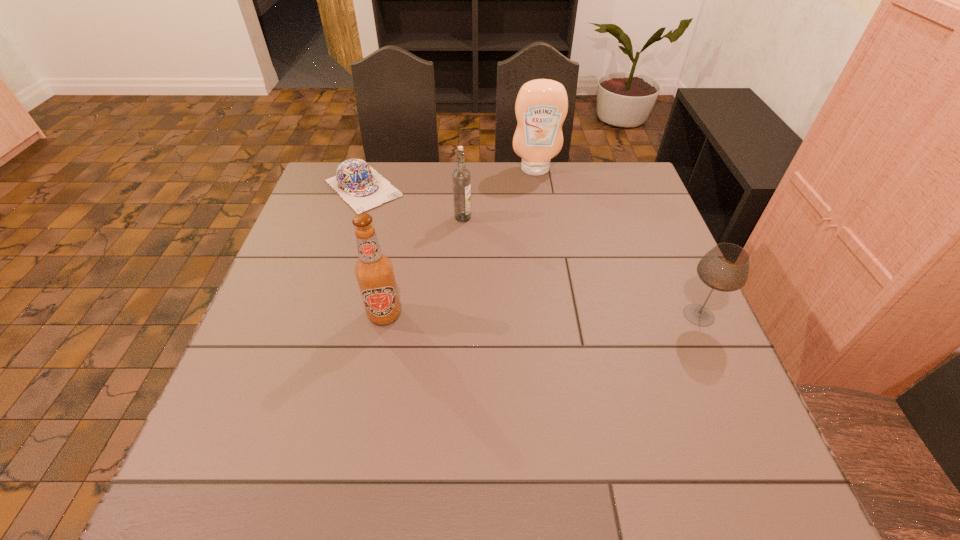
The height and width of the screenshot is (540, 960). What are the coordinates of `vacant point located on the label of the third object from left to right` in the screenshot? It's located at (558, 294).

The width and height of the screenshot is (960, 540). I want to click on vacant space situated on the label of the third object from left to right, so click(x=489, y=238).

The width and height of the screenshot is (960, 540). In order to click on free spot located on the label of the second object from right to left in this screenshot , I will do `click(537, 186)`.

This screenshot has width=960, height=540. I want to click on vacant space located 0.160m on the label of the second object from right to left, so click(x=540, y=208).

Where is `vacant space situated on the label of the second object from right to left`? vacant space situated on the label of the second object from right to left is located at coordinates (538, 192).

Image resolution: width=960 pixels, height=540 pixels. I want to click on vacant space positioned 0.340m on the front, side, and top of the cap, so click(x=452, y=275).

The image size is (960, 540). In order to click on vacant region located 0.370m on the front, side, and top of the cap in this screenshot , I will do `click(460, 281)`.

Where is `free space located on the front, side, and top of the cap`? The height and width of the screenshot is (540, 960). free space located on the front, side, and top of the cap is located at coordinates point(432,255).

I want to click on condiment that is at the far edge, so click(541, 106).

Image resolution: width=960 pixels, height=540 pixels. I want to click on cap at the far edge, so pyautogui.click(x=363, y=188).